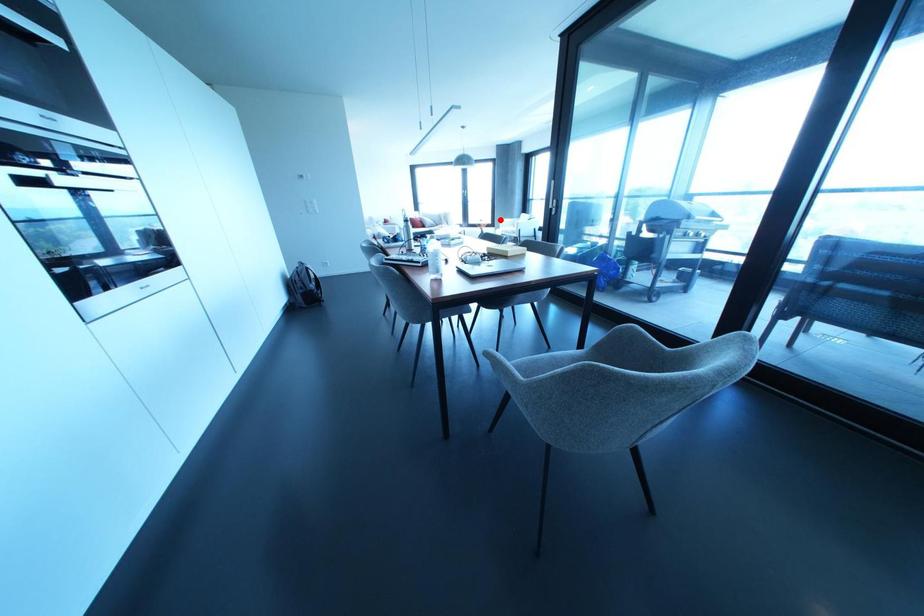
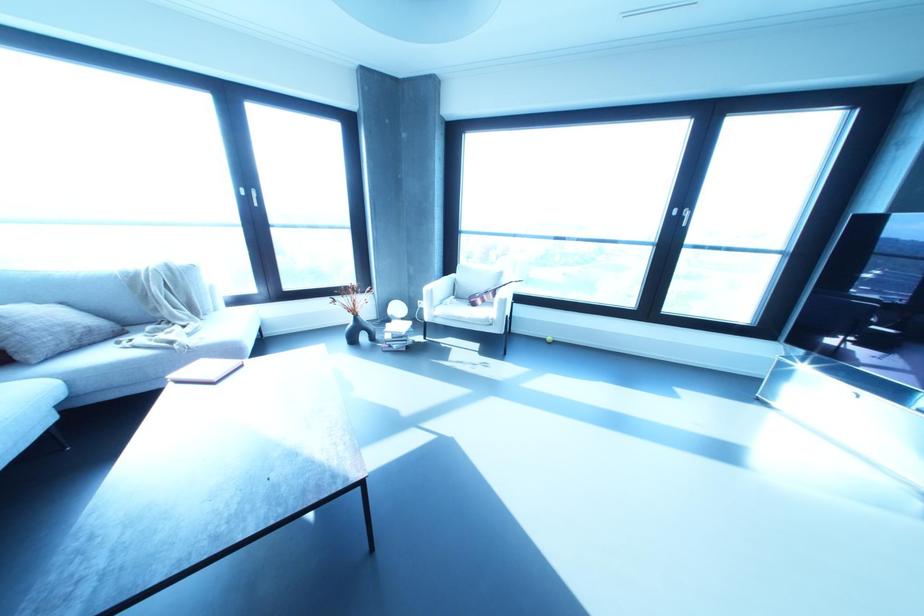
In the second image, find the point that corresponds to the highlighted location in the first image.

(426, 288)